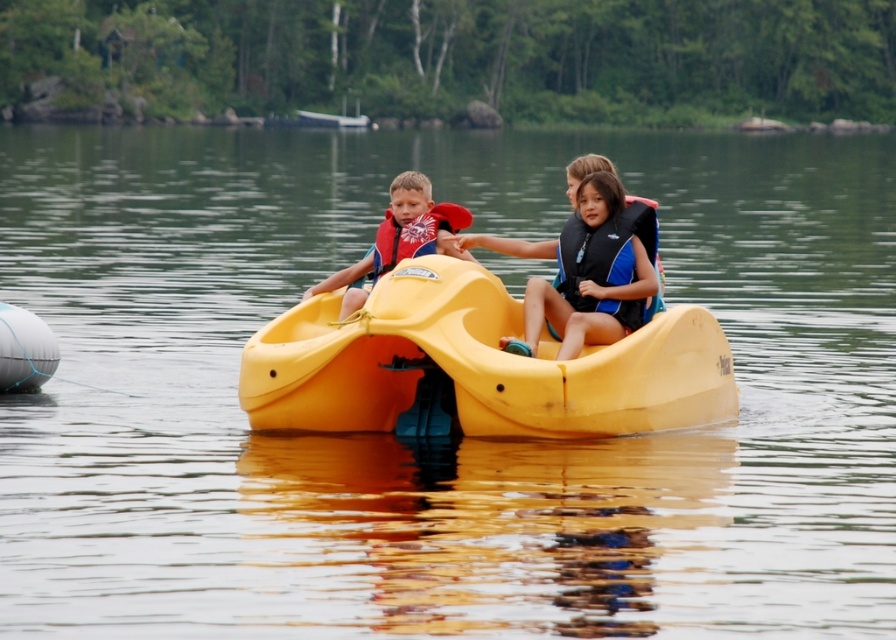
You are a GUI agent. You are given a task and a screenshot of the screen. Output one action in this format:
    pyautogui.click(x=<x>, y=<y>)
    Task: Click on the matte blue life vest at center
    Image resolution: width=896 pixels, height=640 pixels.
    Given the screenshot: What is the action you would take?
    pyautogui.click(x=589, y=268)

You are a GUI agent. You are given a task and a screenshot of the screen. Output one action in this format:
    pyautogui.click(x=<x>, y=<y>)
    Task: Click on the matte blue life vest at center
    This screenshot has width=896, height=640.
    Given the screenshot: What is the action you would take?
    coord(589,268)

At what (x,y) coordinates should I click in order to perform the action: click on matte blue life vest at center. Please return your answer as a coordinate pair (x, y). The height and width of the screenshot is (640, 896). Looking at the image, I should click on (589, 268).

Does blue/black fabric life jacket at center appear on the left side of matte red life jacket at center?

In fact, blue/black fabric life jacket at center is to the right of matte red life jacket at center.

Can you confirm if blue/black fabric life jacket at center is positioned to the right of matte red life jacket at center?

Yes, blue/black fabric life jacket at center is to the right of matte red life jacket at center.

You are a GUI agent. You are given a task and a screenshot of the screen. Output one action in this format:
    pyautogui.click(x=<x>, y=<y>)
    Task: Click on the blue/black fabric life jacket at center
    Image resolution: width=896 pixels, height=640 pixels.
    Given the screenshot: What is the action you would take?
    pyautogui.click(x=604, y=256)

Is point (472, 289) positioned after point (381, 230)?

No, (472, 289) is in front of (381, 230).

Is the position of yellow plastic boat at center less distant than that of matte red life vest at center?

Yes, it is.

Is point (610, 397) farther from viewer compared to point (425, 243)?

No, it is not.

At what (x,y) coordinates should I click in order to perform the action: click on yellow plastic boat at center. Please return your answer as a coordinate pair (x, y). This screenshot has height=640, width=896. Looking at the image, I should click on (475, 365).